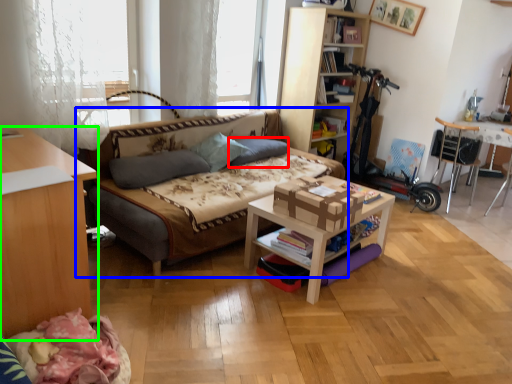
Question: Which object is the closest to the pillow (highlighted by a red box)? Choose among these: studio couch (highlighted by a blue box) or desk (highlighted by a green box).

Choices:
 (A) studio couch
 (B) desk

Answer: (A)